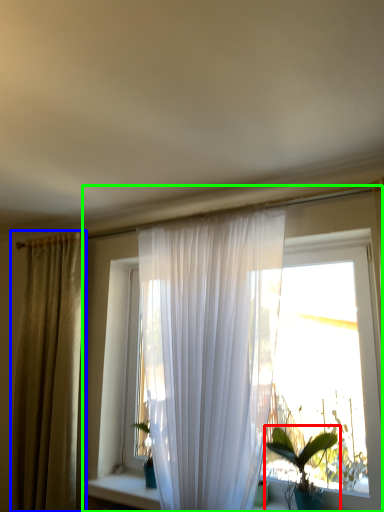
Question: Which is farther away from houseplant (highlighted by a red box)? curtain (highlighted by a blue box) or window (highlighted by a green box)?

Choices:
 (A) curtain
 (B) window

Answer: (A)